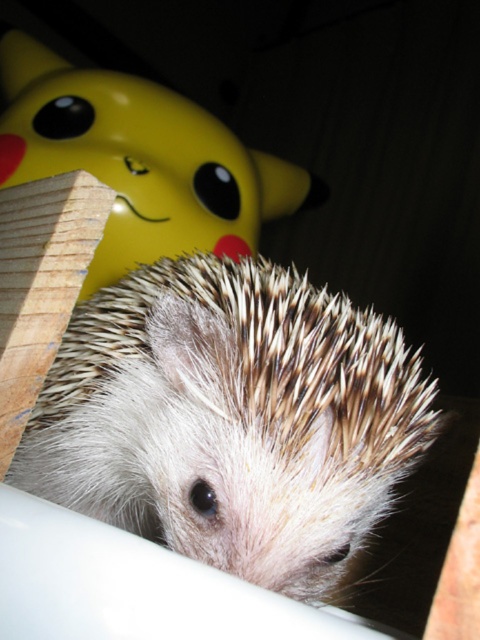
Does white spiny hedgehog at center have a greater height compared to yellow matte pikachu at upper left?

No.

Is white spiny hedgehog at center shorter than yellow matte pikachu at upper left?

Indeed, white spiny hedgehog at center has a lesser height compared to yellow matte pikachu at upper left.

Between point (96, 416) and point (141, 186), which one is positioned in front?

Point (96, 416) is in front.

Locate an element on the screen. This screenshot has height=640, width=480. white spiny hedgehog at center is located at coordinates (230, 419).